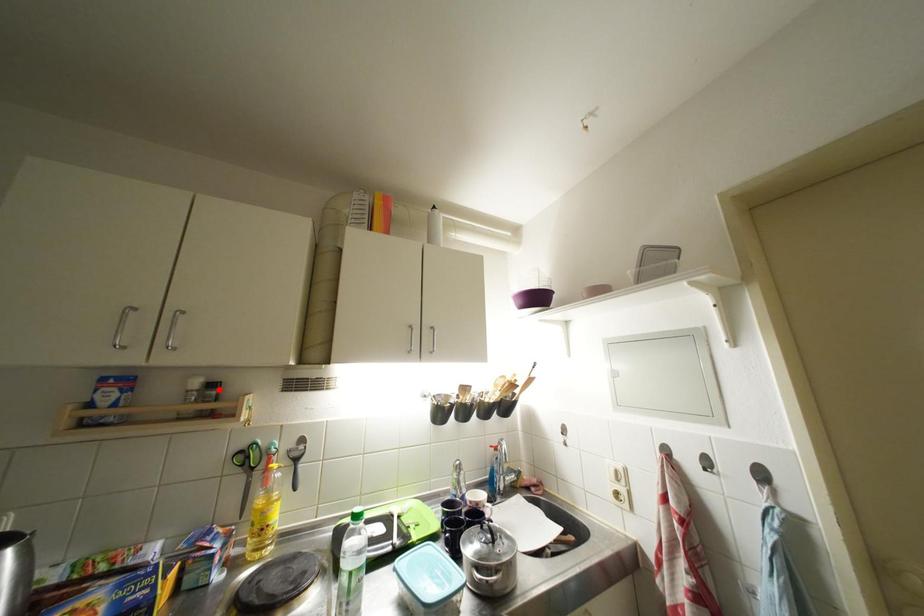
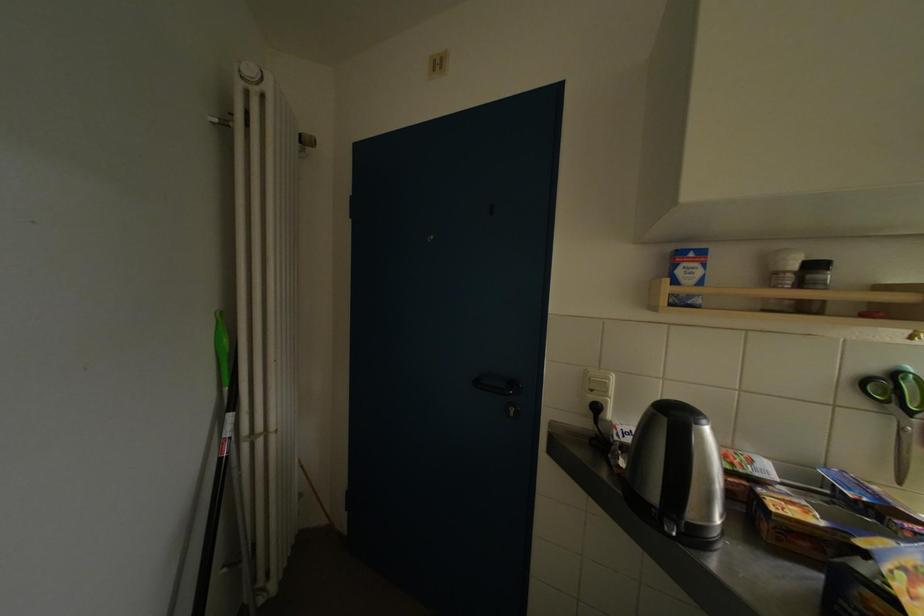
Find the pixel in the second image that matches the highlighted location in the first image.

(821, 270)